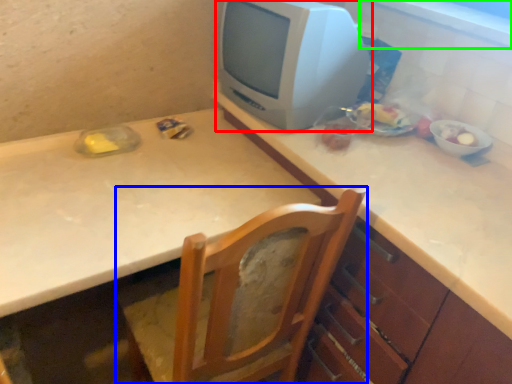
Question: Which object is the farthest from television (highlighted by a red box)? Choose among these: chair (highlighted by a blue box) or window sill (highlighted by a green box).

Choices:
 (A) chair
 (B) window sill

Answer: (A)